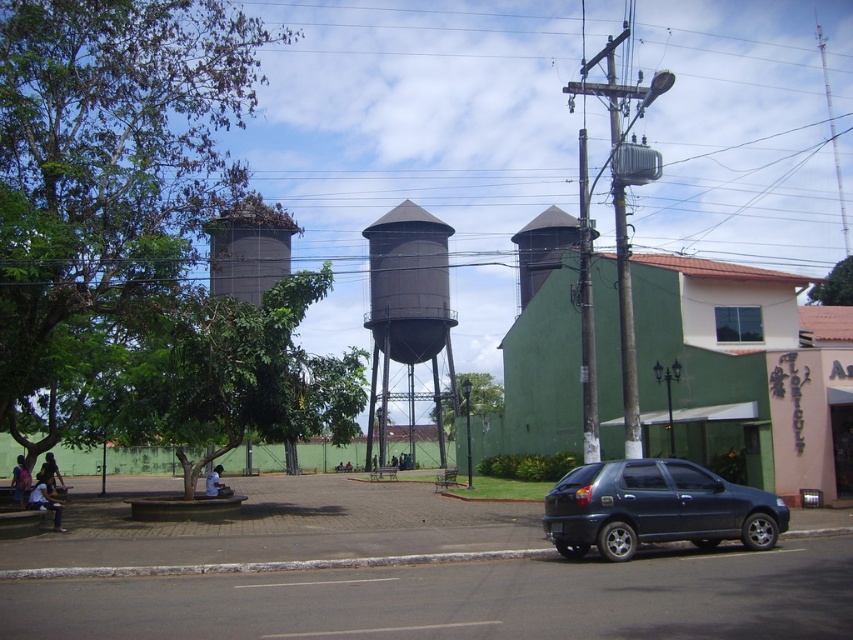
You are a pedestrian standing on the sidewalk and want to cross the street to reach the green building with a red roof. There is a shiny black hatchback at lower right and a dark gray metallic water tower at center. Which object should you avoid while crossing the street?

You should avoid the shiny black hatchback at lower right because it is located on the street, whereas the dark gray metallic water tower at center is positioned further back and not directly on the path.

You are a delivery driver who needs to park your shiny black hatchback at lower right in a parking spot that can only accommodate vehicles thinner than the dark gray metallic water tower at center. Can your vehicle fit?

The shiny black hatchback at lower right is thinner than the dark gray metallic water tower at center, so it can fit in the parking spot.